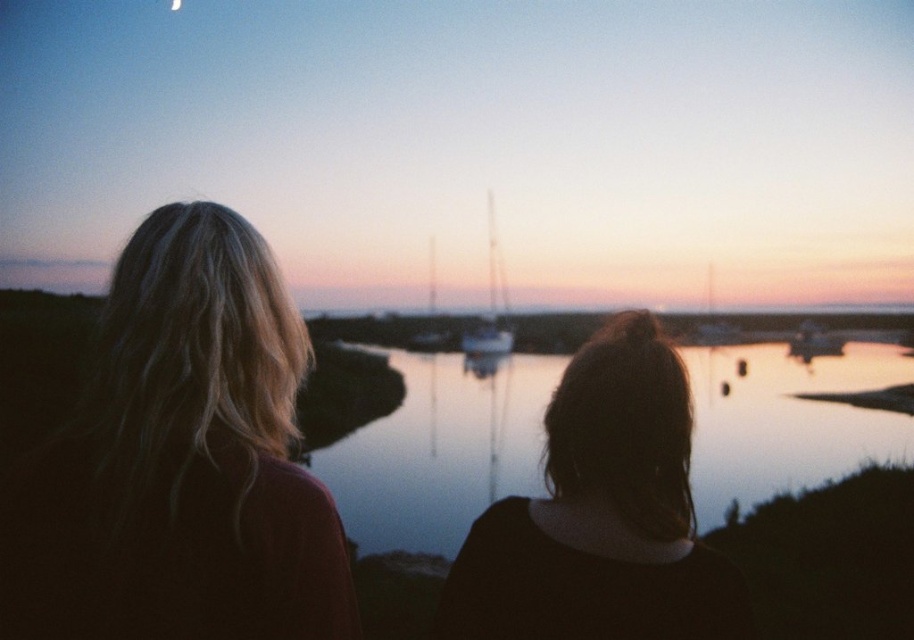
Consider the image. You are standing on the dock and see the glossy water at center and the metallic sailboat at center. Which object is positioned to the right of the other?

The glossy water at center is to the right of the metallic sailboat at center.

You are planning to take a photo of the scene. The glossy water at center and the metallic sailboat at center are both in the frame. Which object should you focus on if you want to capture the largest subject in the image?

The glossy water at center is bigger than the metallic sailboat at center, so you should focus on the glossy water at center to capture the largest subject in the image.

You are a photographer trying to capture the perfect shot of the blonde hair at left and the metallic sailboat at center. Which object appears narrower in the photo?

The blonde hair at left appears narrower than the metallic sailboat at center because it has a lesser width compared to the metallic sailboat at center.